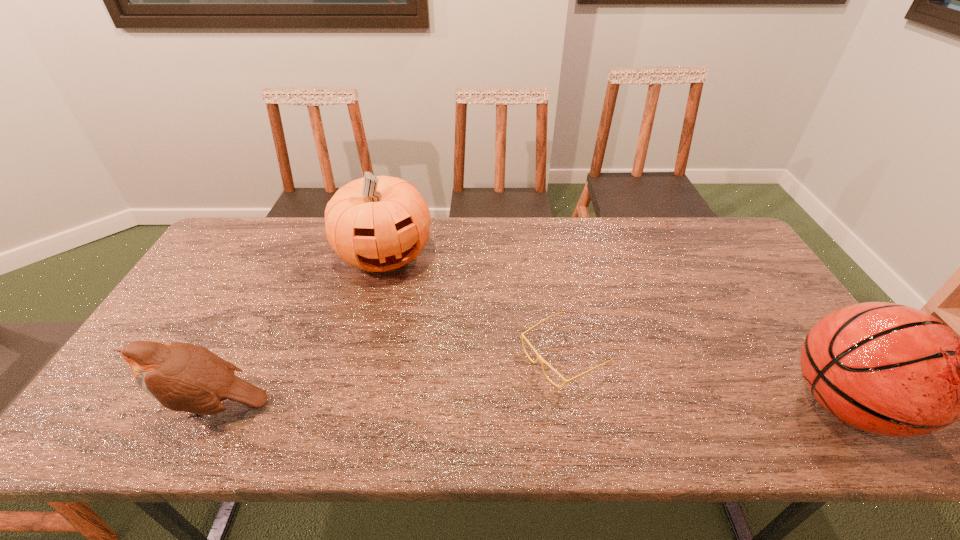
Image resolution: width=960 pixels, height=540 pixels. I want to click on vacant point that satisfies the following two spatial constraints: 1. on the front side of the rightmost object; 2. on the side with spill of the shortest object, so click(573, 404).

The width and height of the screenshot is (960, 540). I want to click on free location that satisfies the following two spatial constraints: 1. on the front side of the basketball; 2. on the side with spill of the third object from left to right, so (x=573, y=404).